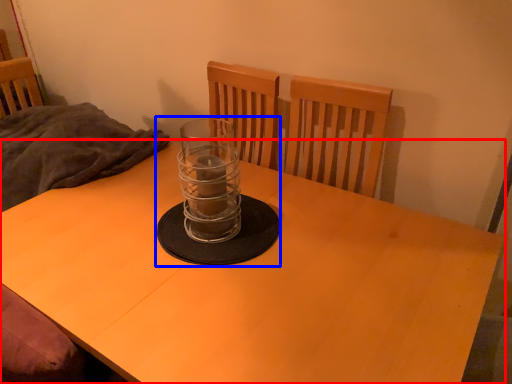
Question: Which object is further to the camera taking this photo, desk (highlighted by a red box) or candle holder (highlighted by a blue box)?

Choices:
 (A) desk
 (B) candle holder

Answer: (B)